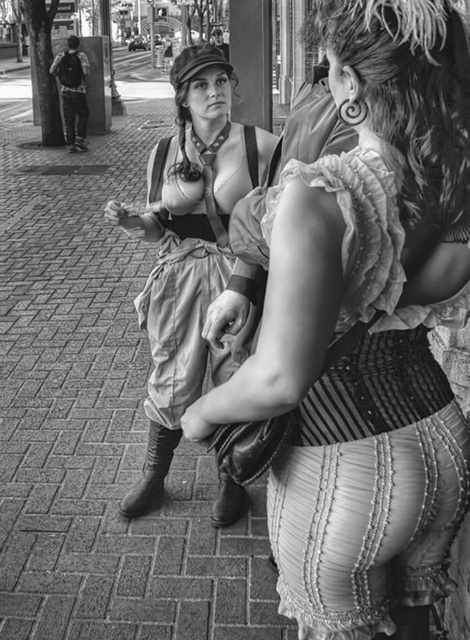
You are a costume designer examining this historical street scene. You need to determine the spatial relationship between the matte leather vest at center and the leather boot at center. Which object is positioned higher up in the image?

The matte leather vest at center is taller than the leather boot at center, so the matte leather vest at center is positioned higher up in the image.

You are standing at the point with coordinates point (216, 513) and want to move to the point with coordinates point (240, 132). Is the point you want to reach in front of or behind you?

Point (240, 132) is in front of point (216, 513), so the point you want to reach is in front of you.